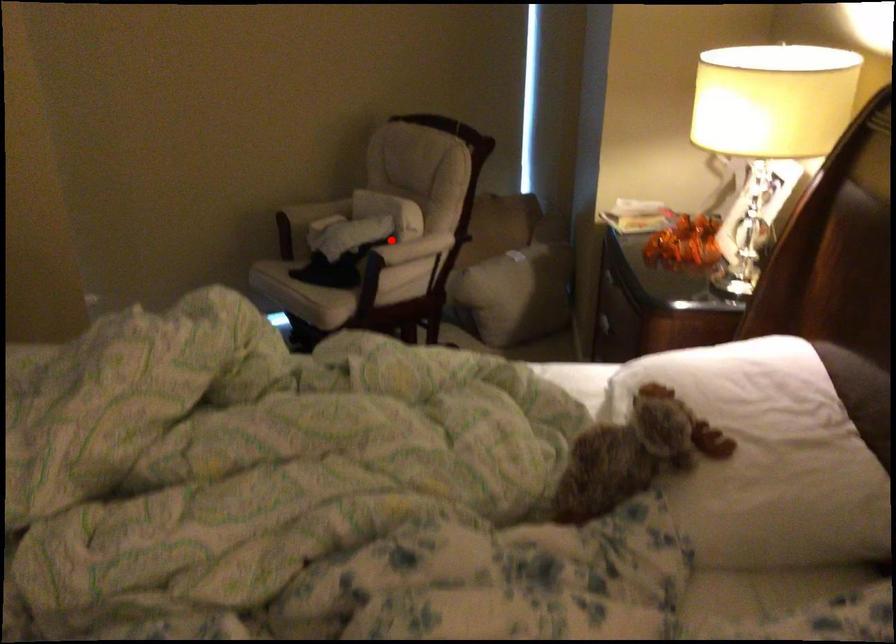
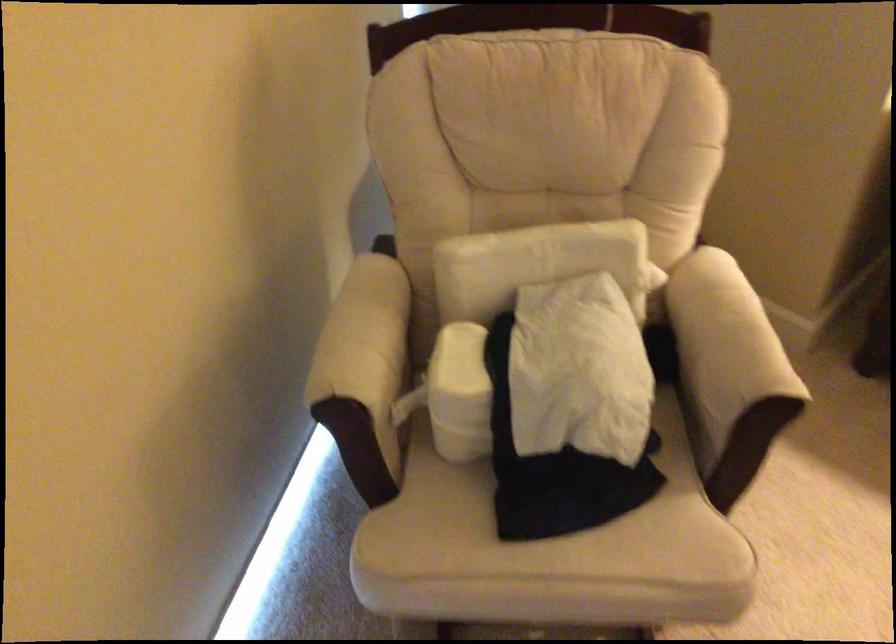
Where in the second image is the point corresponding to the highlighted location from the first image?

(724, 348)